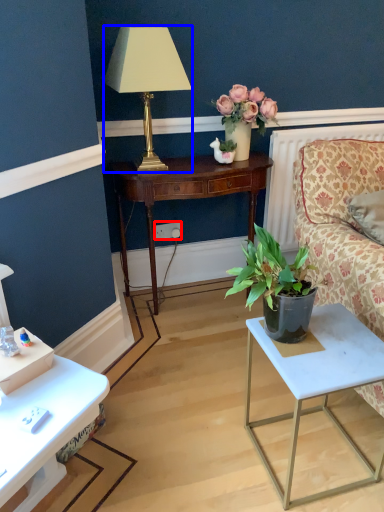
Question: Which of the following is the farthest to the observer, power outlet (highlighted by a red box) or lamp (highlighted by a blue box)?

Choices:
 (A) power outlet
 (B) lamp

Answer: (A)